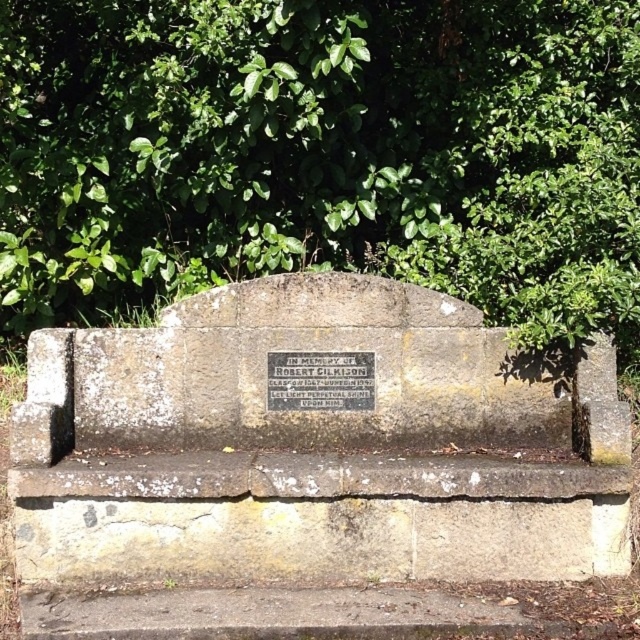
Question: Which of the following is the closest to the observer?

Choices:
 (A) weathered stone bench at center
 (B) green leafy tree at upper center

Answer: (A)

Question: Can you confirm if green leafy tree at upper center is bigger than weathered stone bench at center?

Choices:
 (A) no
 (B) yes

Answer: (B)

Question: Among these points, which one is nearest to the camera?

Choices:
 (A) (355, 17)
 (B) (157, 328)
 (C) (342, 369)

Answer: (B)

Question: Based on their relative distances, which object is farther from the green leafy tree at upper center?

Choices:
 (A) weathered stone bench at center
 (B) silver metallic plaque at center

Answer: (B)

Question: Is weathered stone bench at center to the right of silver metallic plaque at center from the viewer's perspective?

Choices:
 (A) no
 (B) yes

Answer: (B)

Question: Can you confirm if weathered stone bench at center is positioned to the right of silver metallic plaque at center?

Choices:
 (A) no
 (B) yes

Answer: (B)